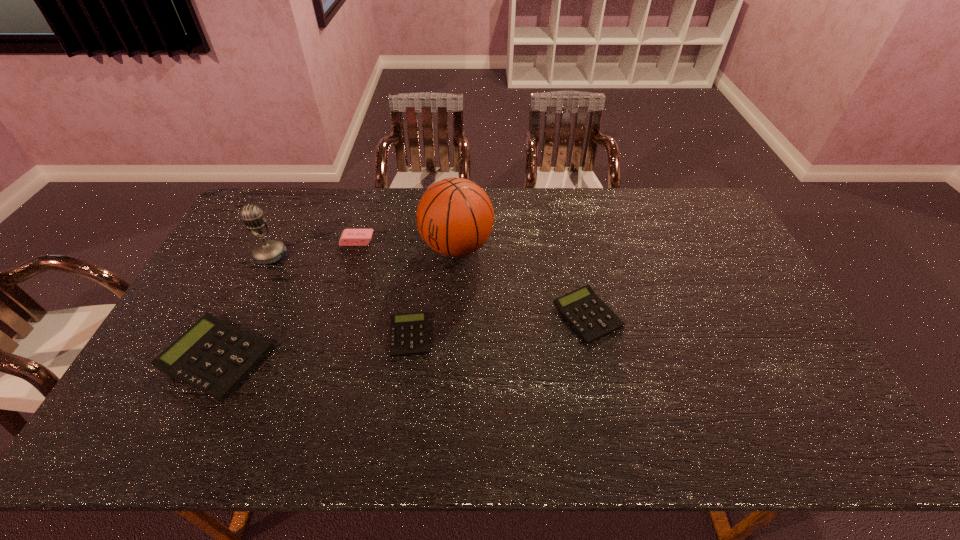
Identify the location of the fourth tallest object. This screenshot has height=540, width=960. (213, 356).

The image size is (960, 540). I want to click on the leftmost calculator, so click(213, 356).

Where is `the shortest calculator`? Image resolution: width=960 pixels, height=540 pixels. the shortest calculator is located at coordinates (409, 335).

You are a GUI agent. You are given a task and a screenshot of the screen. Output one action in this format:
    pyautogui.click(x=<x>, y=<y>)
    Task: Click on the second calculator from right to left
    The width and height of the screenshot is (960, 540).
    Given the screenshot: What is the action you would take?
    pyautogui.click(x=409, y=335)

What are the coordinates of `the second tallest calculator` in the screenshot? It's located at (590, 317).

At what (x,y) coordinates should I click in order to perform the action: click on the fifth tallest object. Please return your answer as a coordinate pair (x, y). The width and height of the screenshot is (960, 540). Looking at the image, I should click on (590, 317).

Image resolution: width=960 pixels, height=540 pixels. I want to click on the tallest object, so point(455,217).

Locate an element on the screen. The width and height of the screenshot is (960, 540). eraser is located at coordinates (350, 237).

Identify the location of microphone. The width and height of the screenshot is (960, 540). (271, 251).

The height and width of the screenshot is (540, 960). I want to click on vacant region located on the back of the leftmost calculator, so click(270, 251).